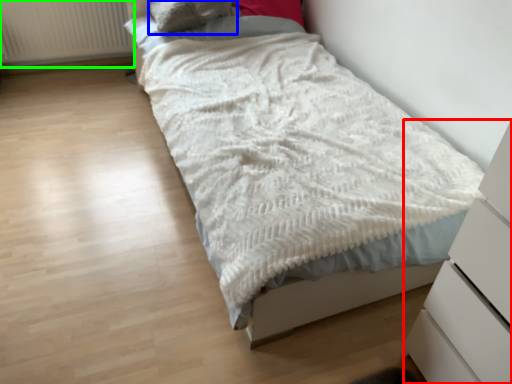
Question: Based on their relative distances, which object is nearer to chest of drawers (highlighted by a red box)? Choose from pillow (highlighted by a blue box) and radiator (highlighted by a green box).

Choices:
 (A) pillow
 (B) radiator

Answer: (A)